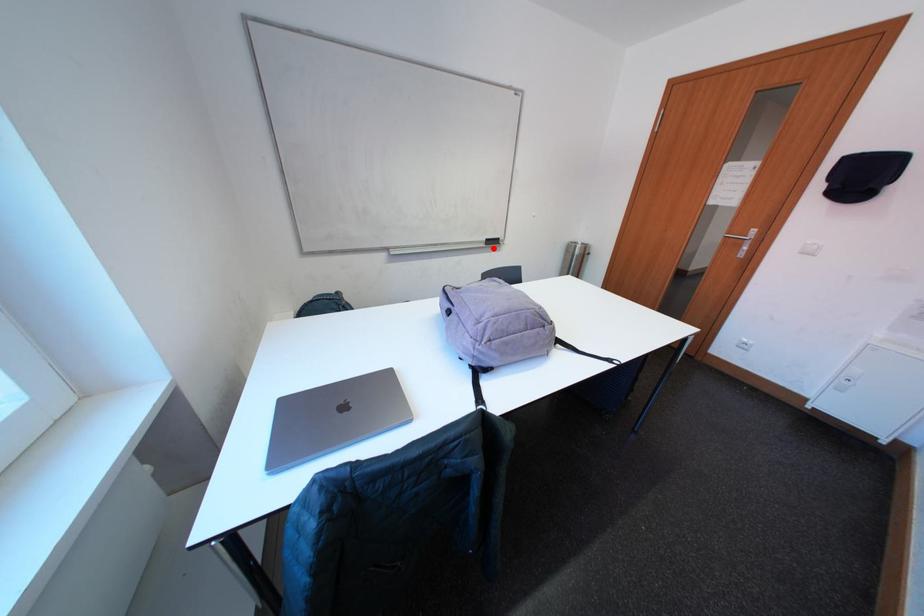
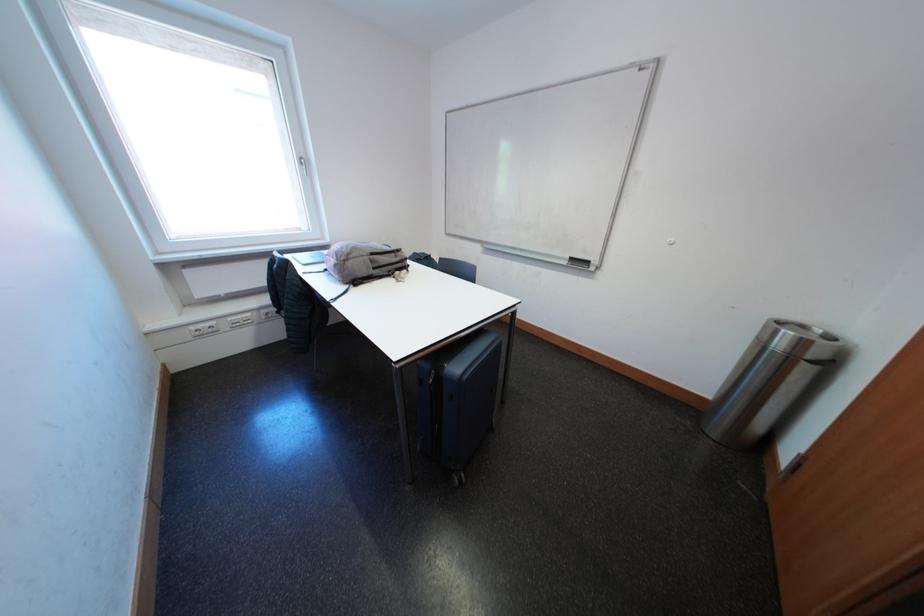
In the second image, find the point that corresponds to the highlighted location in the first image.

(575, 267)